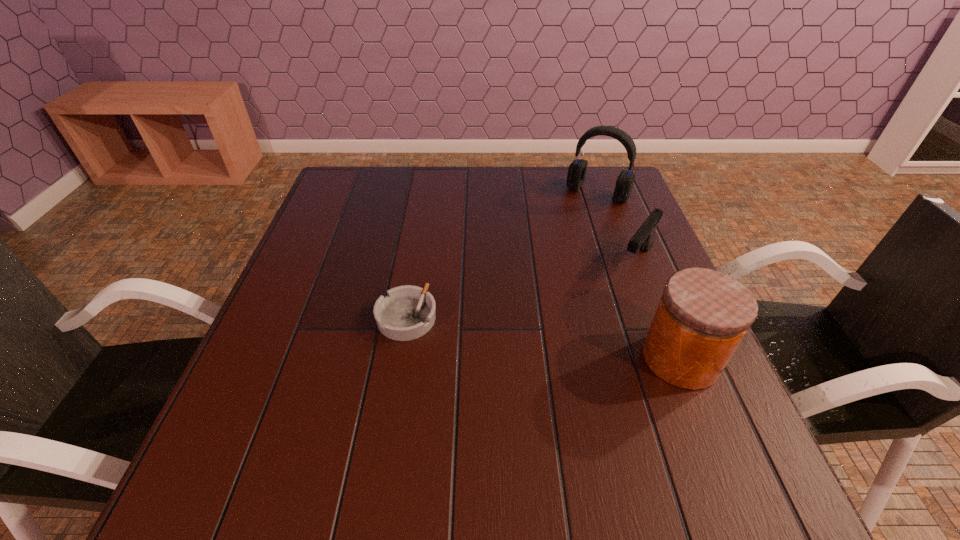
I want to click on the shortest object, so click(407, 312).

Where is `ashtray`? Image resolution: width=960 pixels, height=540 pixels. ashtray is located at coordinates click(x=407, y=312).

You are a GUI agent. You are given a task and a screenshot of the screen. Output one action in this format:
    pyautogui.click(x=<x>, y=<y>)
    Task: Click on the jar
    
    Given the screenshot: What is the action you would take?
    pyautogui.click(x=703, y=315)

The height and width of the screenshot is (540, 960). I want to click on pistol, so click(643, 239).

Where is `the second farthest object`? Image resolution: width=960 pixels, height=540 pixels. the second farthest object is located at coordinates (643, 239).

In order to click on the farthest object in this screenshot , I will do `click(577, 169)`.

Where is `blank space located on the back of the leftmost object`? This screenshot has width=960, height=540. blank space located on the back of the leftmost object is located at coordinates (424, 211).

This screenshot has width=960, height=540. I want to click on free space located on the left of the jar, so click(x=452, y=359).

You are a GUI agent. You are given a task and a screenshot of the screen. Output one action in this format:
    pyautogui.click(x=<x>, y=<y>)
    Task: Click on the free space located 0.200m on the front-facing side of the second farthest object
    The height and width of the screenshot is (540, 960).
    Given the screenshot: What is the action you would take?
    pyautogui.click(x=591, y=328)

Find the location of a particular element. This screenshot has height=540, width=960. blank space located 0.240m on the front-facing side of the second farthest object is located at coordinates (583, 340).